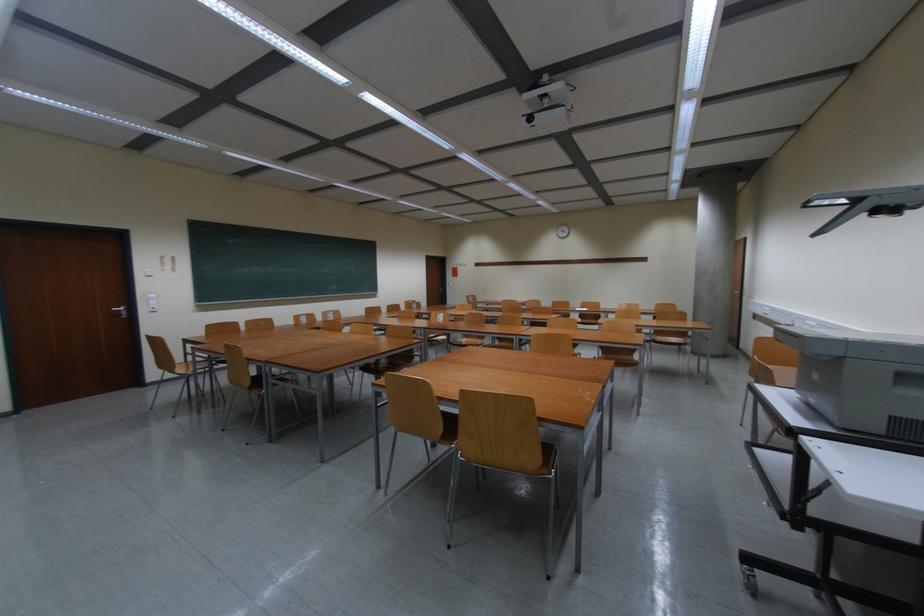
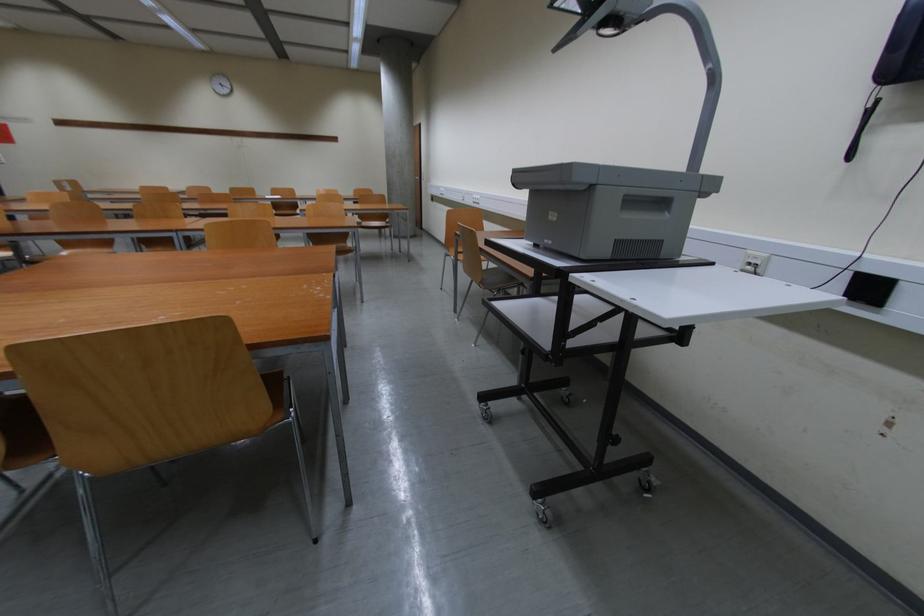
How did the camera likely rotate?

The rotation direction of the camera is right-down.